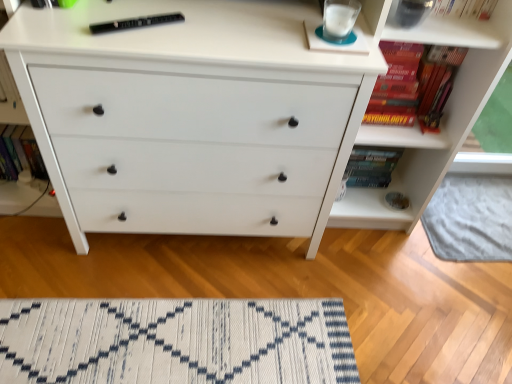
Identify the location of free space on the front side of black plastic remote at upper center, the third book viewed from the right. (122, 46).